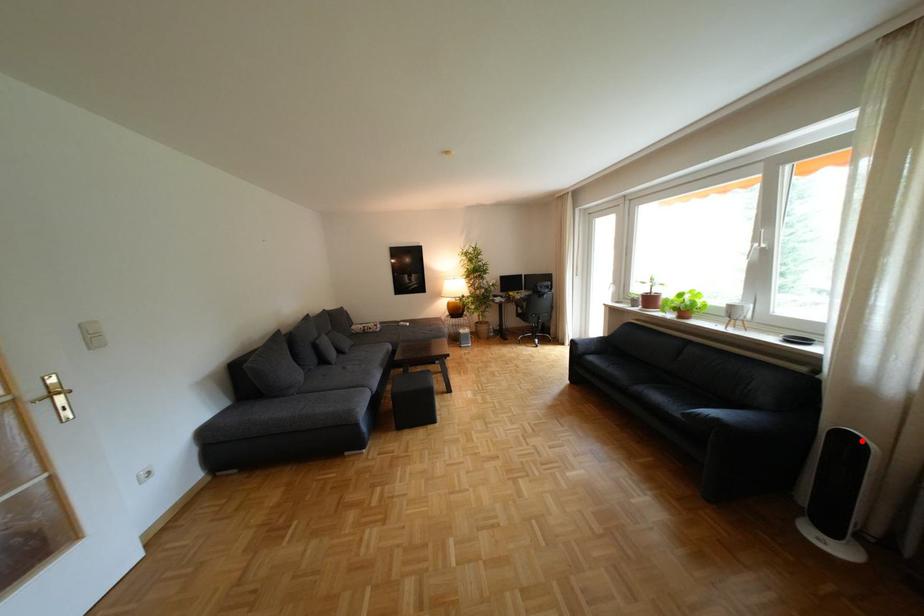
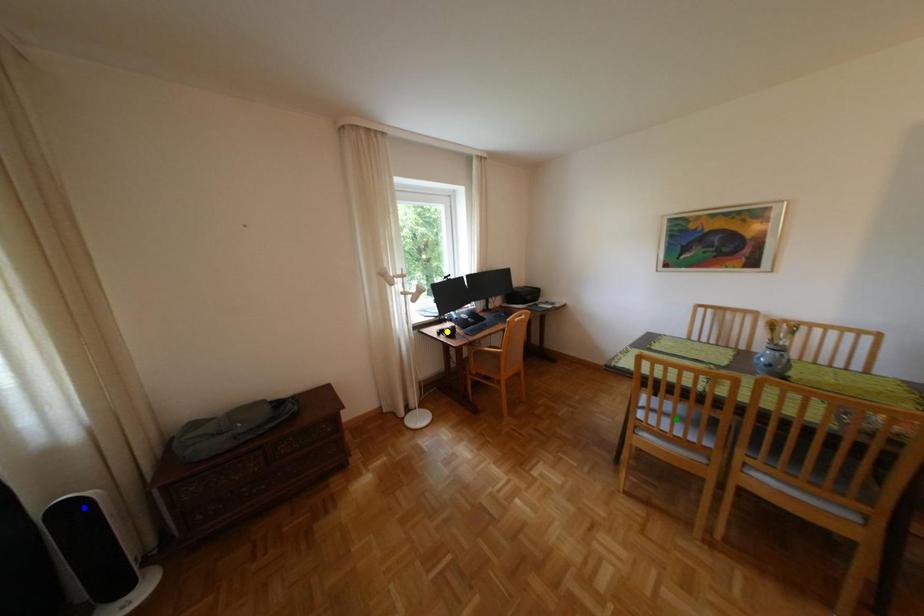
Question: I am providing you with two images of the same scene from different viewpoints. A red point is marked on the first image. You are given multiple points on the second image. Which point in image 2 represents the same 3d spot as the red point in image 1?

Choices:
 (A) blue point
 (B) yellow point
 (C) green point

Answer: (A)